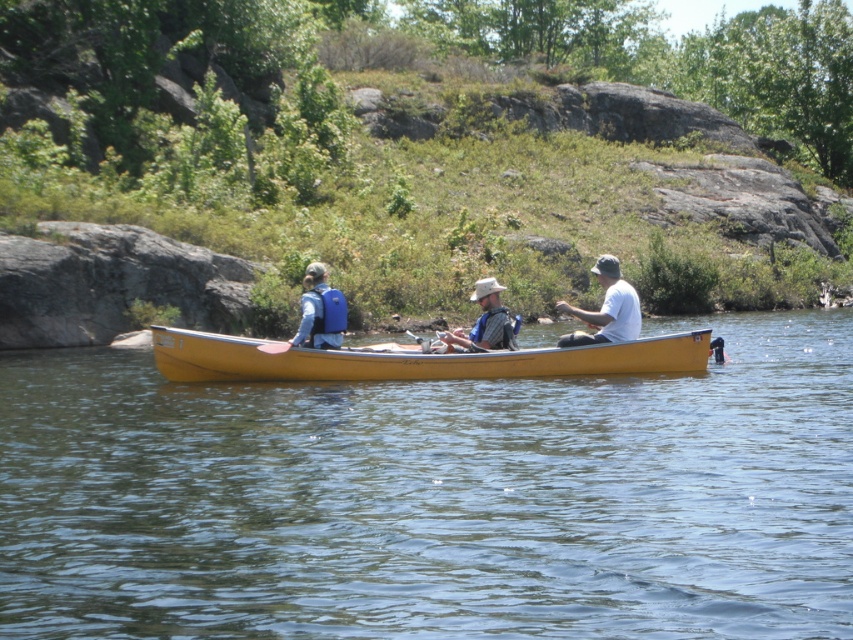
Which of these two, yellow wood boat at center or matte blue life vest at center, stands shorter?

matte blue life vest at center is shorter.

Does yellow wood boat at center have a lesser height compared to matte blue life vest at center?

No.

Find the location of a particular element. This screenshot has height=640, width=853. yellow wood boat at center is located at coordinates (434, 499).

Is yellow wood canoe at center above matte blue life vest at center?

No, yellow wood canoe at center is not above matte blue life vest at center.

Does yellow wood canoe at center appear under matte blue life vest at center?

Yes, yellow wood canoe at center is below matte blue life vest at center.

Image resolution: width=853 pixels, height=640 pixels. I want to click on yellow wood canoe at center, so click(x=415, y=358).

Does yellow wood boat at center appear over matte gray hat at center?

Incorrect, yellow wood boat at center is not positioned above matte gray hat at center.

Can you confirm if yellow wood boat at center is positioned below matte gray hat at center?

Yes.

Which is behind, point (343, 544) or point (492, 324)?

The point (492, 324) is behind.

Locate an element on the screen. The image size is (853, 640). yellow wood boat at center is located at coordinates (434, 499).